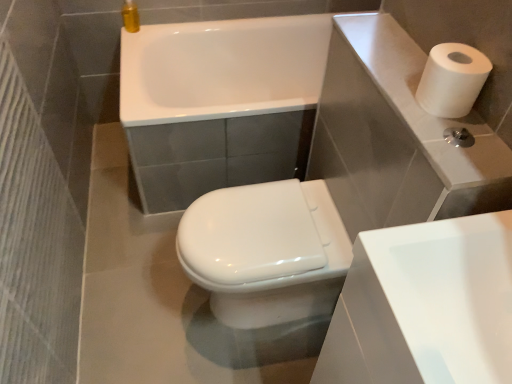
Identify the location of free space to the left of white glossy bidet at center. (137, 294).